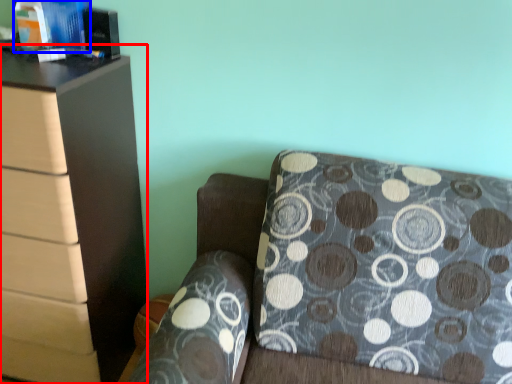
Question: Which object is further to the camera taking this photo, chest of drawers (highlighted by a red box) or book (highlighted by a blue box)?

Choices:
 (A) chest of drawers
 (B) book

Answer: (B)